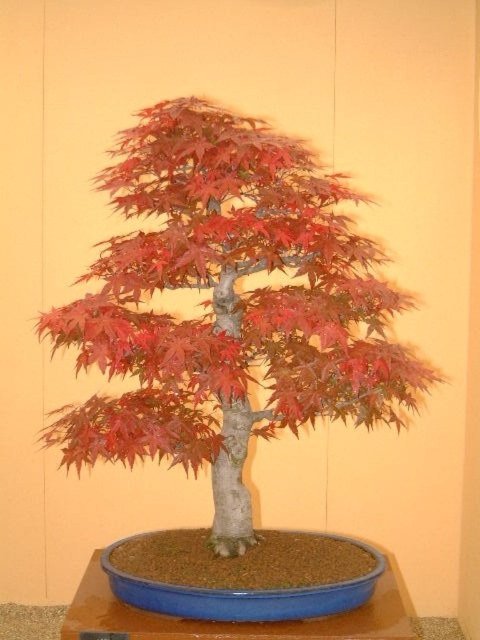
Question: Among these points, which one is nearest to the camera?

Choices:
 (A) (223, 332)
 (B) (118, 586)

Answer: (B)

Question: Among these objects, which one is farthest from the camera?

Choices:
 (A) blue plastic tray at center
 (B) matte red bonsai tree at center

Answer: (A)

Question: Is matte red bonsai tree at center in front of blue plastic tray at center?

Choices:
 (A) no
 (B) yes

Answer: (B)

Question: Among these objects, which one is farthest from the camera?

Choices:
 (A) blue plastic tray at center
 (B) matte red bonsai tree at center

Answer: (A)

Question: Considering the relative positions of matte red bonsai tree at center and blue plastic tray at center in the image provided, where is matte red bonsai tree at center located with respect to blue plastic tray at center?

Choices:
 (A) below
 (B) above

Answer: (B)

Question: Can you confirm if matte red bonsai tree at center is positioned to the right of blue plastic tray at center?

Choices:
 (A) no
 (B) yes

Answer: (A)